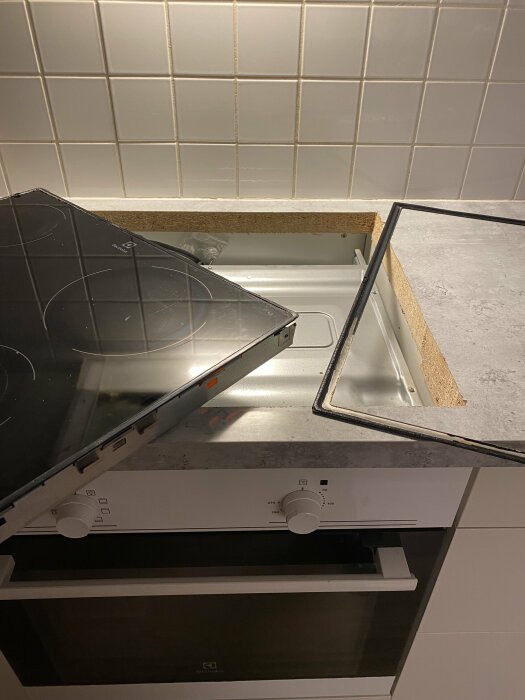
Locate an element on the screen. oven door handle is located at coordinates (381, 592).